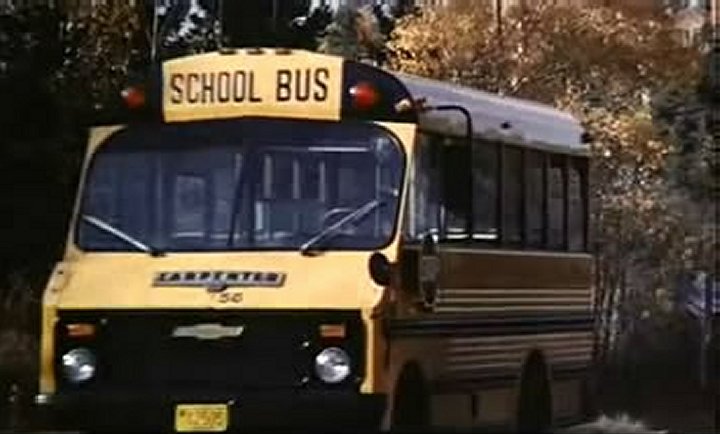
The width and height of the screenshot is (720, 434). In order to click on windows in this screenshot , I will do `click(444, 204)`, `click(466, 199)`, `click(504, 199)`, `click(528, 201)`, `click(549, 203)`, `click(572, 202)`.